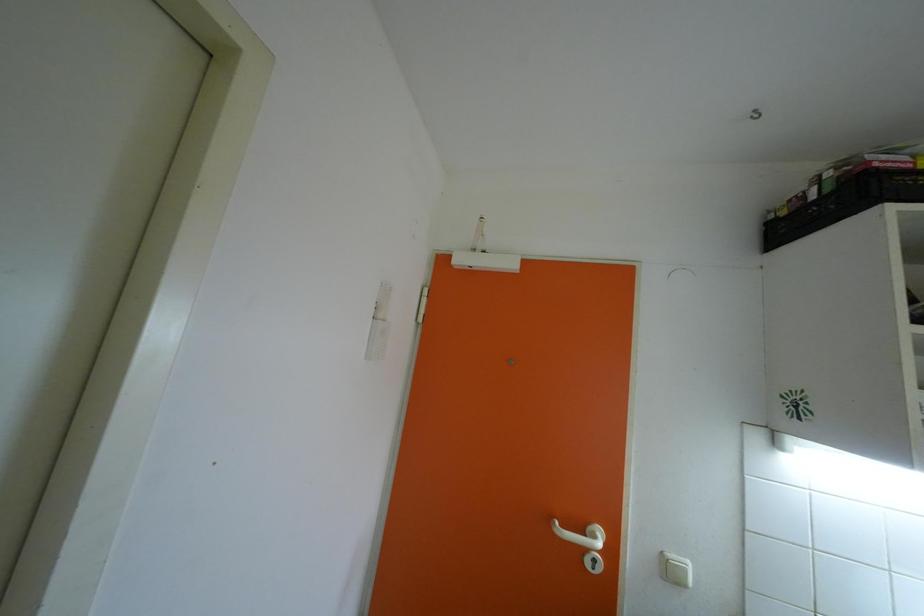
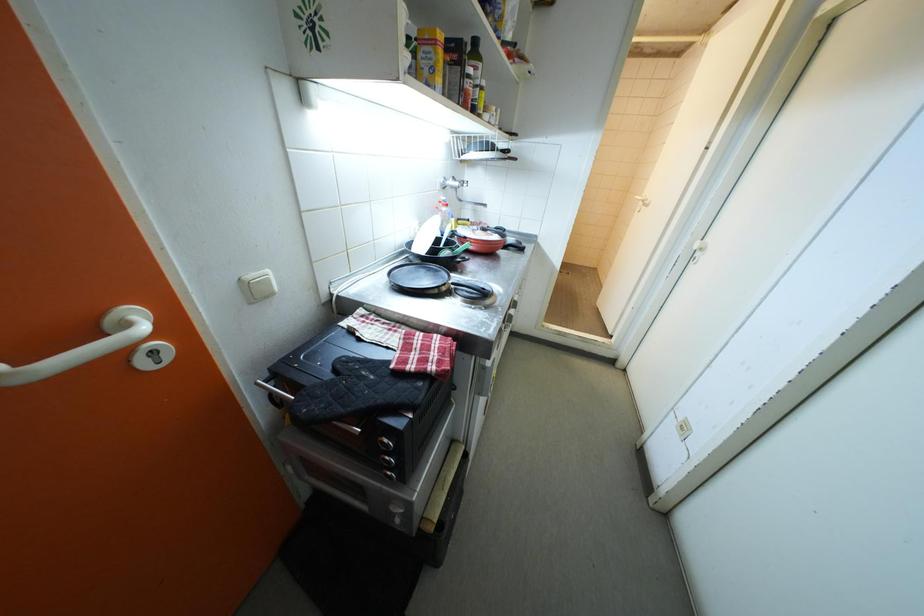
The first image is from the beginning of the video and the second image is from the end. How did the camera likely rotate when shooting the video?

The camera rotated toward right-down.